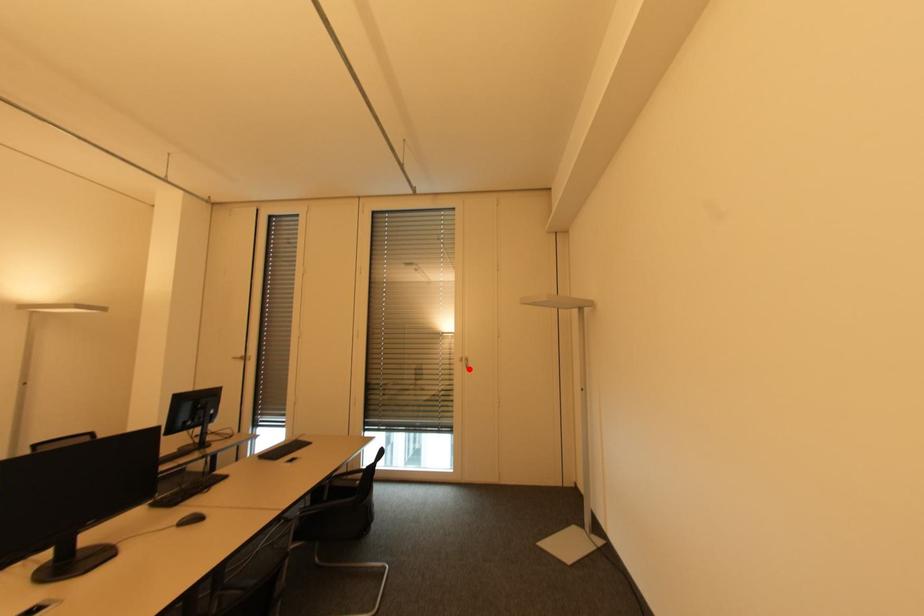
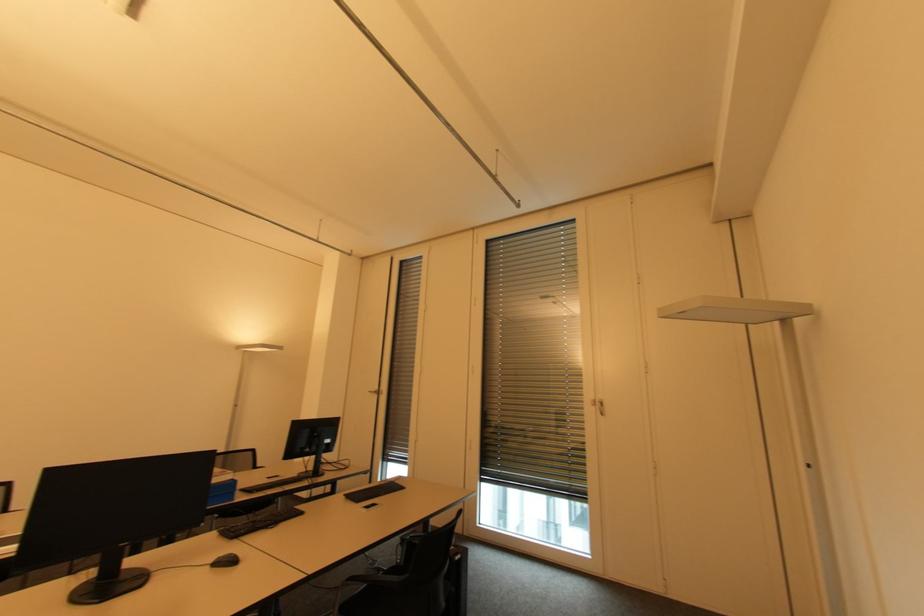
In the second image, find the point that corresponds to the highlighted location in the first image.

(603, 416)